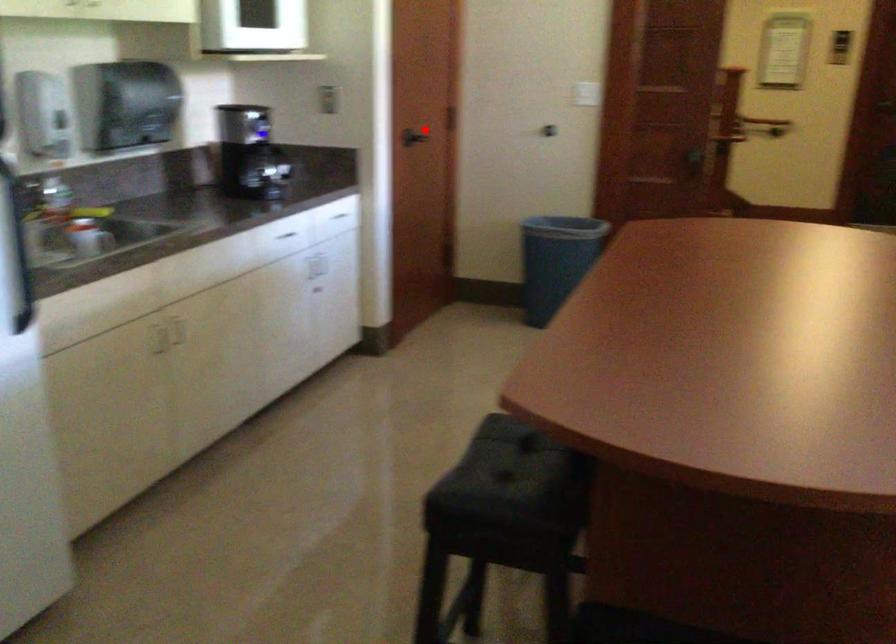
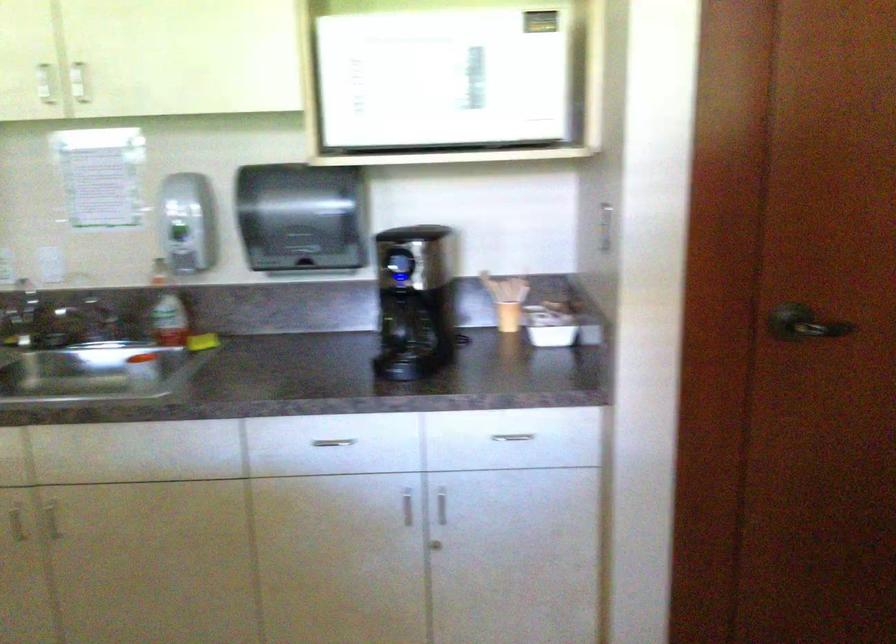
Question: I am providing you with two images of the same scene from different viewpoints. Image1 has a red point marked. In image2, the corresponding 3D location appears at what relative position? Reply with the corresponding letter.

Choices:
 (A) Closer
 (B) Farther

Answer: (A)